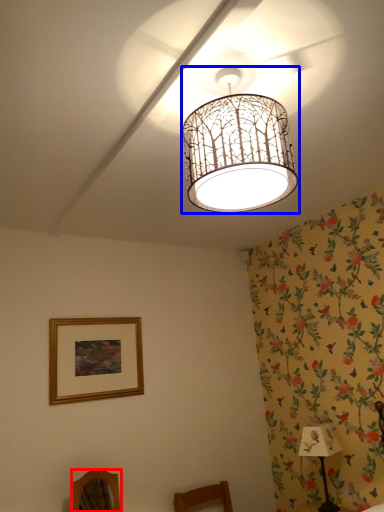
Question: Which point is further to the camera, furniture (highlighted by a red box) or lamp (highlighted by a blue box)?

Choices:
 (A) furniture
 (B) lamp

Answer: (A)